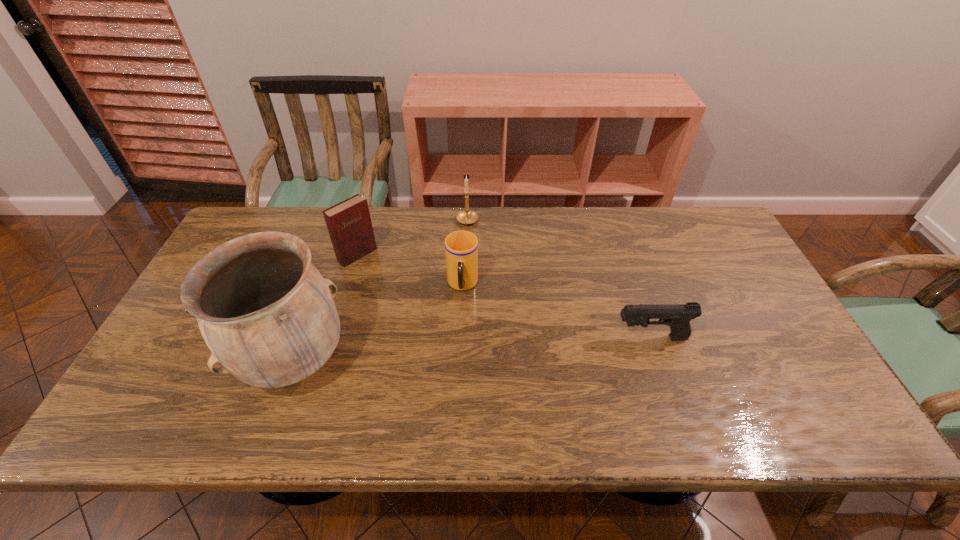
Where is `free space on the desktop that is between the tallest object and the rightmost object and is positioned on the handle side of the candle holder`? The width and height of the screenshot is (960, 540). free space on the desktop that is between the tallest object and the rightmost object and is positioned on the handle side of the candle holder is located at coordinates (445, 351).

Identify the location of free space on the desktop that is between the tallest object and the pistol and is positioned on the front cover of the second farthest object. The width and height of the screenshot is (960, 540). (472, 349).

You are a GUI agent. You are given a task and a screenshot of the screen. Output one action in this format:
    pyautogui.click(x=<x>, y=<y>)
    Task: Click on the vacant spot on the desktop that is between the tallest object and the rightmost object and is positioned on the side of the third nearest object with the handle
    The height and width of the screenshot is (540, 960).
    Given the screenshot: What is the action you would take?
    pyautogui.click(x=458, y=350)